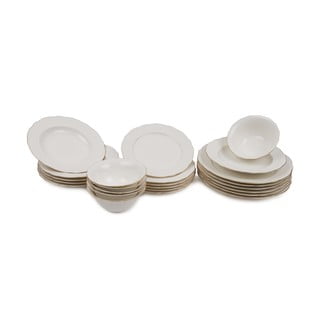
Where is `bowl`? bowl is located at coordinates (118, 176), (131, 185), (131, 191), (126, 196), (124, 205), (234, 128).